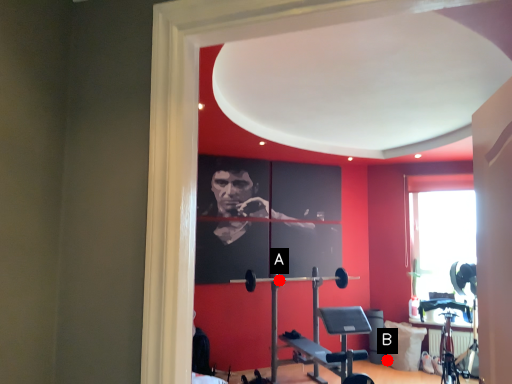
Question: Two points are circled on the image, labeled by A and B beside each circle. Which point is farther to the camera?

Choices:
 (A) A is further
 (B) B is further

Answer: (A)